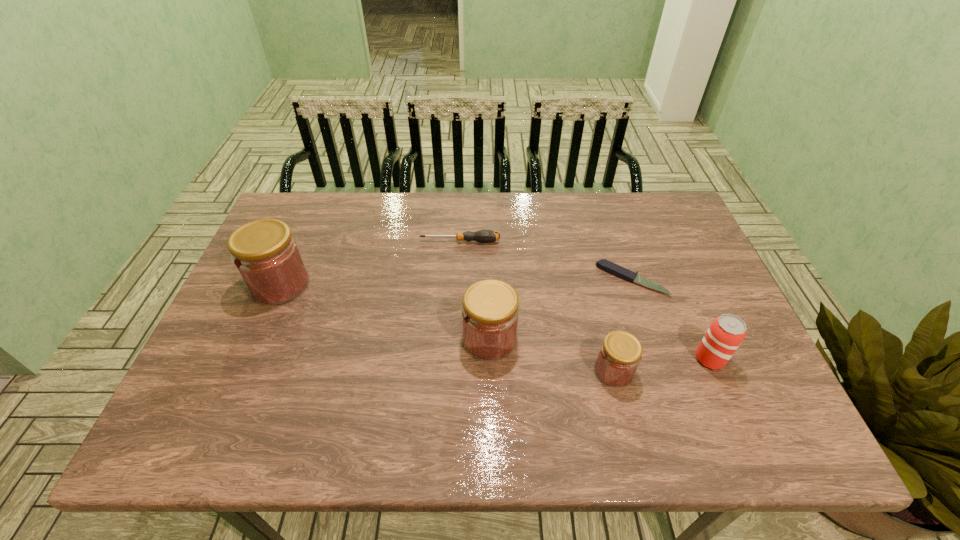
Locate an element on the screen. The height and width of the screenshot is (540, 960). free space located on the back of the second tallest jam is located at coordinates (488, 241).

Identify the location of vacant area situated 0.240m on the left of the rightmost jam. (490, 371).

The height and width of the screenshot is (540, 960). What are the coordinates of `vacant space situated 0.330m on the right of the second shortest object` in the screenshot? It's located at (610, 241).

Image resolution: width=960 pixels, height=540 pixels. Find the location of `vacant point located 0.360m on the left of the beer can`. vacant point located 0.360m on the left of the beer can is located at coordinates (541, 359).

Where is `free space located 0.330m on the left of the shortest object`? The image size is (960, 540). free space located 0.330m on the left of the shortest object is located at coordinates (479, 280).

I want to click on object present at the far edge, so click(x=485, y=236).

Image resolution: width=960 pixels, height=540 pixels. Identify the location of jam located at the near edge. (619, 356).

Image resolution: width=960 pixels, height=540 pixels. Find the location of `beer can situated at the near edge`. beer can situated at the near edge is located at coordinates (725, 334).

You are a GUI agent. You are given a task and a screenshot of the screen. Output one action in this format:
    pyautogui.click(x=<x>, y=<y>)
    Task: Click on the object positioned at the left edge
    The height and width of the screenshot is (540, 960).
    Given the screenshot: What is the action you would take?
    pyautogui.click(x=266, y=255)

Where is `beer can situated at the right edge`? The width and height of the screenshot is (960, 540). beer can situated at the right edge is located at coordinates (725, 334).